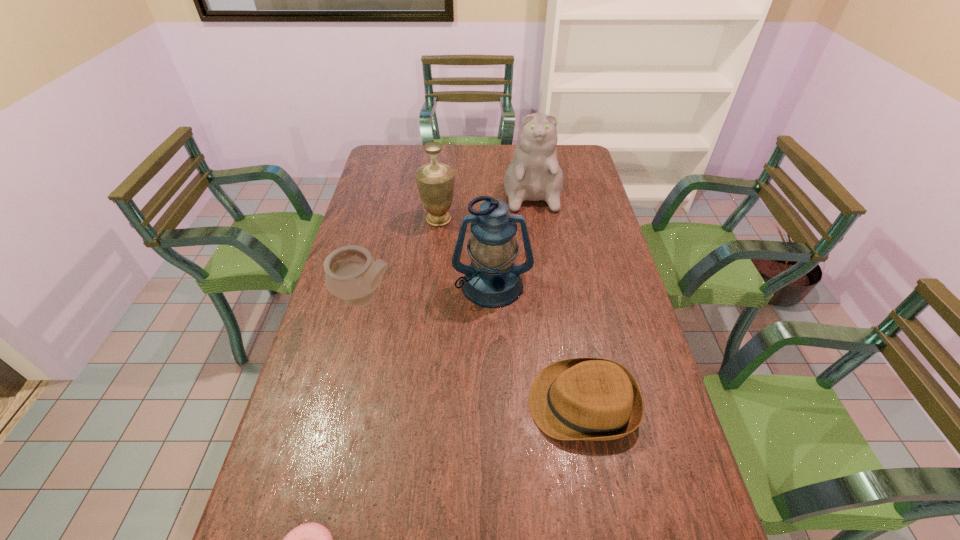
I want to click on free space at the right edge of the desktop, so (x=582, y=282).

In the image, there is a desktop. Identify the location of vacant space at the far right corner. This screenshot has height=540, width=960. (583, 146).

What are the coordinates of `vacant area that lies between the second nearest object and the urn` in the screenshot? It's located at (511, 312).

At what (x,y) coordinates should I click in order to perform the action: click on free spot between the second shortest object and the third object from left to right. Please return your answer as a coordinate pair (x, y). The width and height of the screenshot is (960, 540). Looking at the image, I should click on (511, 312).

Locate an element on the screen. This screenshot has height=540, width=960. free spot between the fedora and the fourth object from right to left is located at coordinates (511, 312).

Find the location of `empty space between the cat and the third shortest object`. empty space between the cat and the third shortest object is located at coordinates (447, 241).

Locate an element on the screen. The width and height of the screenshot is (960, 540). vacant area between the pottery and the second shortest object is located at coordinates (473, 351).

Where is `free space between the third shortest object and the cat`? This screenshot has height=540, width=960. free space between the third shortest object and the cat is located at coordinates (447, 241).

The width and height of the screenshot is (960, 540). I want to click on unoccupied area between the fifth farthest object and the urn, so click(511, 312).

The image size is (960, 540). I want to click on unoccupied area between the urn and the pottery, so click(x=401, y=259).